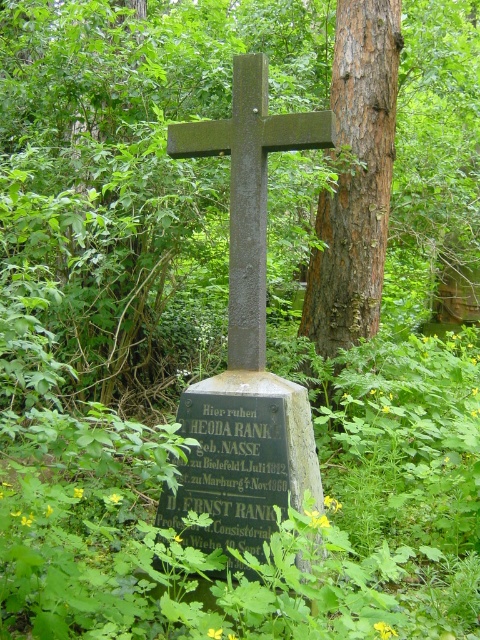
You are a historian examining the cemetery scene. You notice the black stone plaque at center and the dark gray stone cross at center. Which object is taller?

The dark gray stone cross at center is taller than the black stone plaque at center.

You are standing at the entrance of the cemetery and want to find the brown rough bark tree at center. According to the coordinates given, in which direction should you walk from your current position to reach it?

The brown rough bark tree at center is located at point coordinates, so you should walk towards the center of the cemetery from the entrance to reach it.

You are standing at the base of the brown rough bark tree at center and want to place a wreath at the foot of the weathered stone cross in the center. The wreath has a diameter of 1 meter. Can you place it without moving closer than 5 meters to the cross?

The distance between the brown rough bark tree at center and the weathered stone cross in the center is 4.95 meters. Since the wreath has a diameter of 1 meter, placing it would require being within 4.95 meters minus 0.5 meters of the cross, which is 4.45 meters. This is less than the 5 meters requirement, so you cannot place the wreath without moving closer than 5 meters to the cross.